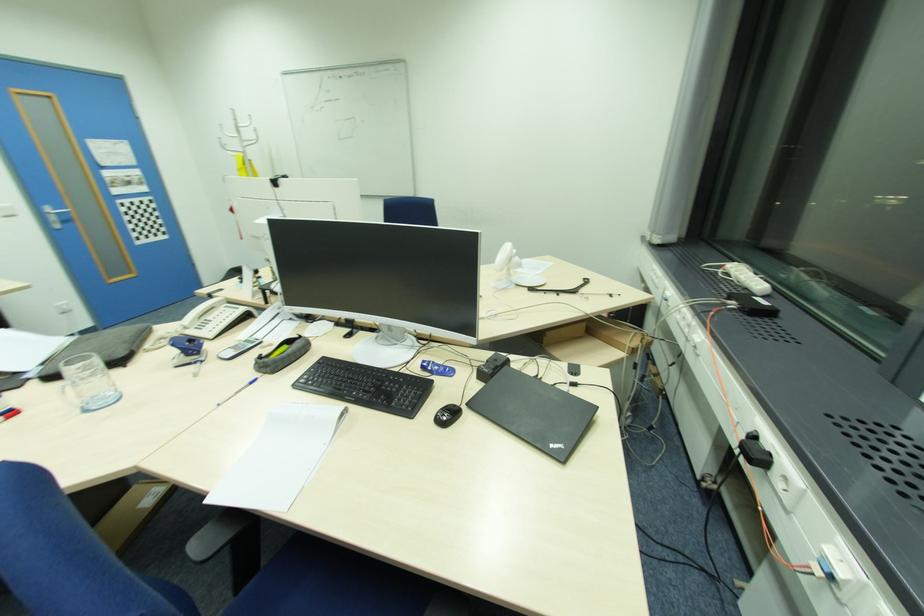
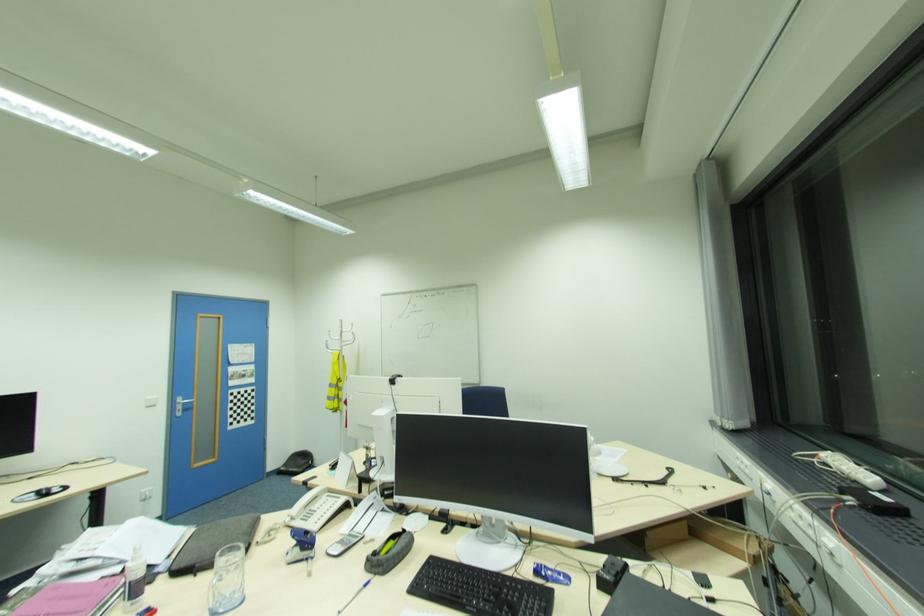
The point at (253, 383) is marked in the first image. Where is the corresponding point in the second image?

(369, 585)